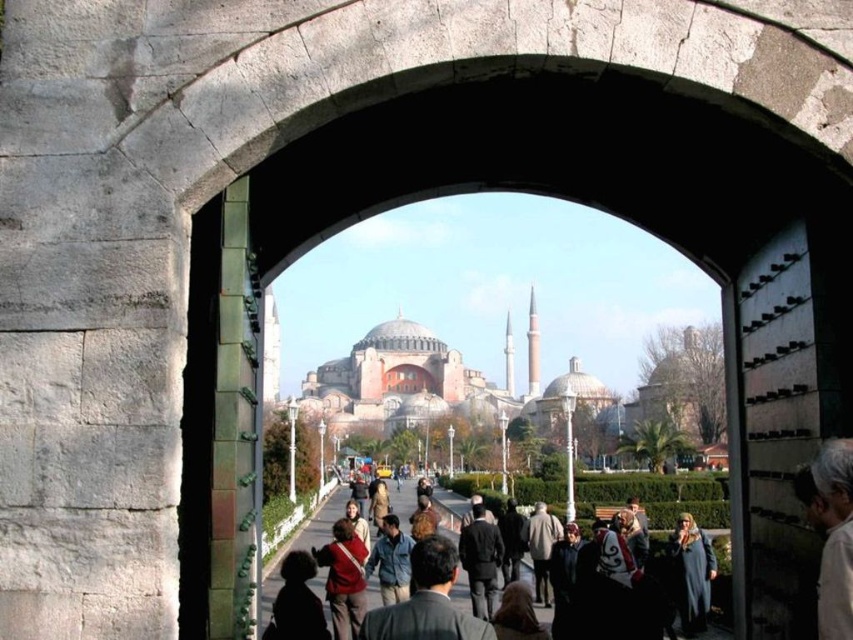
Question: Considering the real-world distances, which object is closest to the matte red sweater at center?

Choices:
 (A) dark gray suit at center
 (B) white fabric at right

Answer: (A)

Question: Does matte red sweater at center have a greater width compared to silhouette figure at lower left?

Choices:
 (A) yes
 (B) no

Answer: (B)

Question: Which point appears farthest from the camera in this image?

Choices:
 (A) (682, 588)
 (B) (471, 506)

Answer: (B)

Question: Based on their relative distances, which object is nearer to the white fabric at right?

Choices:
 (A) dark gray suit at center
 (B) silhouette figure at lower left
 (C) dark blue fabric at center

Answer: (A)

Question: Does silhouette figure at lower left appear under dark gray jacket at center?

Choices:
 (A) yes
 (B) no

Answer: (A)

Question: Can you confirm if dark gray suit at center is positioned to the right of dark gray jacket at center?

Choices:
 (A) yes
 (B) no

Answer: (B)